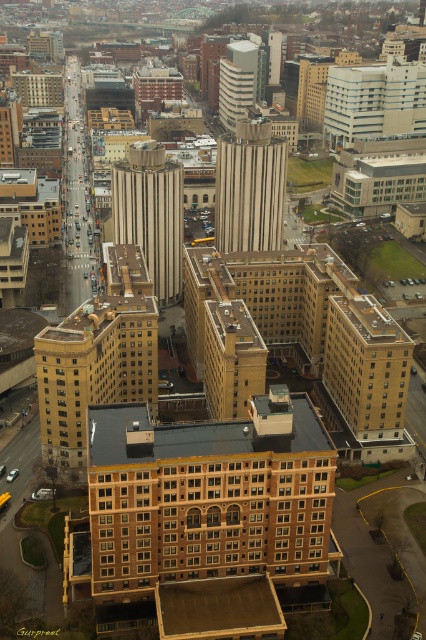
Is white concrete building at upper right shorter than white smooth building at upper center?

Indeed, white concrete building at upper right has a lesser height compared to white smooth building at upper center.

Is point (350, 88) in front of point (235, 52)?

That is True.

Identify the location of white concrete building at upper right. [374, 100].

Is golden brick building at center bigger than white concrete building at upper right?

No.

Can you confirm if golden brick building at center is thinner than white concrete building at upper right?

Indeed, golden brick building at center has a lesser width compared to white concrete building at upper right.

Does point (123, 358) lie behind point (339, 113)?

No, it is in front of (339, 113).

This screenshot has width=426, height=640. Find the location of `golden brick building at center`. golden brick building at center is located at coordinates (97, 356).

Is striped concrete tower at center closer to the viewer compared to white concrete building at upper right?

Yes, striped concrete tower at center is closer to the viewer.

Does striped concrete tower at center appear on the left side of white concrete building at upper right?

Yes, striped concrete tower at center is to the left of white concrete building at upper right.

Between point (262, 234) and point (420, 80), which one is positioned behind?

Positioned behind is point (420, 80).

Where is `striped concrete tower at center`? This screenshot has width=426, height=640. striped concrete tower at center is located at coordinates (250, 186).